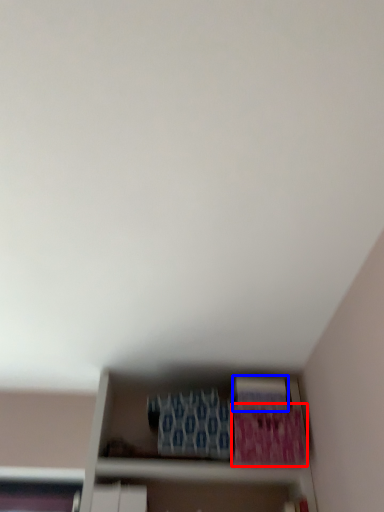
Question: Among these objects, which one is nearest to the camera, paperback book (highlighted by a red box) or paperback book (highlighted by a blue box)?

Choices:
 (A) paperback book
 (B) paperback book

Answer: (A)